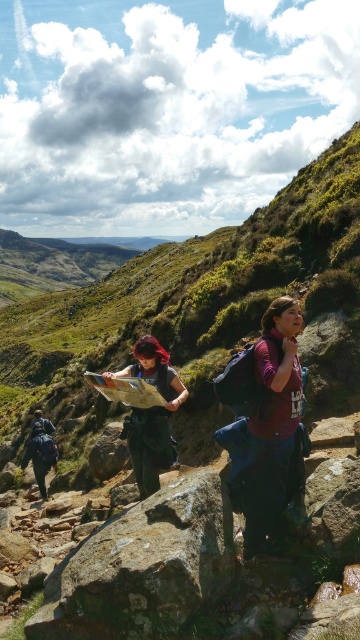
Question: Is green mossy rock at center positioned in front of dark blue backpack at lower left?

Choices:
 (A) no
 (B) yes

Answer: (B)

Question: Which object is the closest to the dark blue backpack at lower left?

Choices:
 (A) dark blue fabric map at center
 (B) green mossy rock at center

Answer: (A)

Question: Can you confirm if green mossy rock at center is positioned above dark blue backpack at lower left?

Choices:
 (A) no
 (B) yes

Answer: (B)

Question: Can you confirm if green mossy rock at center is positioned above dark blue backpack at lower left?

Choices:
 (A) yes
 (B) no

Answer: (A)

Question: Which object is the closest to the dark blue fabric map at center?

Choices:
 (A) green mossy rock at center
 (B) dark blue backpack at lower left

Answer: (A)

Question: Which of the following is the closest to the observer?

Choices:
 (A) (142, 557)
 (B) (132, 456)

Answer: (A)